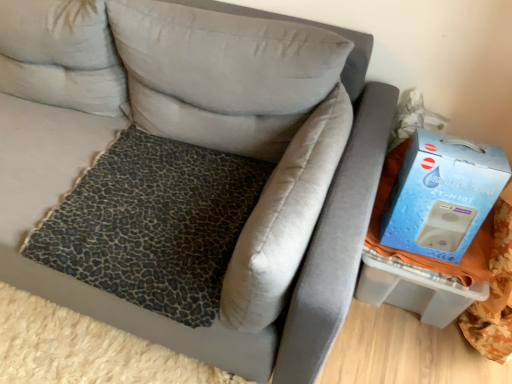
Question: From the image's perspective, is leopard print fabric pillow at center, the 3th pillow when ordered from left to right, on light gray fabric pillow at upper left, acting as the first pillow starting from the left?

Choices:
 (A) no
 (B) yes

Answer: (A)

Question: Is leopard print fabric pillow at center, the 1th pillow from the right, shorter than light gray fabric pillow at upper left, acting as the first pillow starting from the left?

Choices:
 (A) yes
 (B) no

Answer: (A)

Question: Is light gray fabric pillow at upper left, acting as the first pillow starting from the left, surrounded by leopard print fabric pillow at center, the 3th pillow when ordered from left to right?

Choices:
 (A) yes
 (B) no

Answer: (B)

Question: Considering the relative sizes of leopard print fabric pillow at center, the 1th pillow from the right, and light gray fabric pillow at upper left, marked as the third pillow in a right-to-left arrangement, in the image provided, is leopard print fabric pillow at center, the 1th pillow from the right, taller than light gray fabric pillow at upper left, marked as the third pillow in a right-to-left arrangement,?

Choices:
 (A) yes
 (B) no

Answer: (B)

Question: Is leopard print fabric pillow at center, the 1th pillow from the right, far from light gray fabric pillow at upper left, acting as the first pillow starting from the left?

Choices:
 (A) no
 (B) yes

Answer: (A)

Question: Is leopard print fabric pillow at center, the 1th pillow from the right, facing away from light gray fabric pillow at upper left, marked as the third pillow in a right-to-left arrangement?

Choices:
 (A) yes
 (B) no

Answer: (A)

Question: Can you confirm if leopard print fabric pillow at center, marked as the second pillow in a right-to-left arrangement, is smaller than blue cardboard box at right?

Choices:
 (A) no
 (B) yes

Answer: (A)

Question: Does leopard print fabric pillow at center, arranged as the second pillow when viewed from the left, have a lesser width compared to blue cardboard box at right?

Choices:
 (A) no
 (B) yes

Answer: (A)

Question: Is leopard print fabric pillow at center, arranged as the second pillow when viewed from the left, facing towards blue cardboard box at right?

Choices:
 (A) no
 (B) yes

Answer: (A)

Question: Considering the relative sizes of leopard print fabric pillow at center, marked as the second pillow in a right-to-left arrangement, and blue cardboard box at right in the image provided, is leopard print fabric pillow at center, marked as the second pillow in a right-to-left arrangement, bigger than blue cardboard box at right?

Choices:
 (A) yes
 (B) no

Answer: (A)

Question: Considering the relative positions of leopard print fabric pillow at center, arranged as the second pillow when viewed from the left, and blue cardboard box at right in the image provided, is leopard print fabric pillow at center, arranged as the second pillow when viewed from the left, to the right of blue cardboard box at right from the viewer's perspective?

Choices:
 (A) no
 (B) yes

Answer: (A)

Question: Is leopard print fabric pillow at center, marked as the second pillow in a right-to-left arrangement, far from blue cardboard box at right?

Choices:
 (A) no
 (B) yes

Answer: (A)

Question: Can you confirm if blue cardboard box at right is smaller than light gray fabric pillow at upper left, acting as the first pillow starting from the left?

Choices:
 (A) no
 (B) yes

Answer: (B)